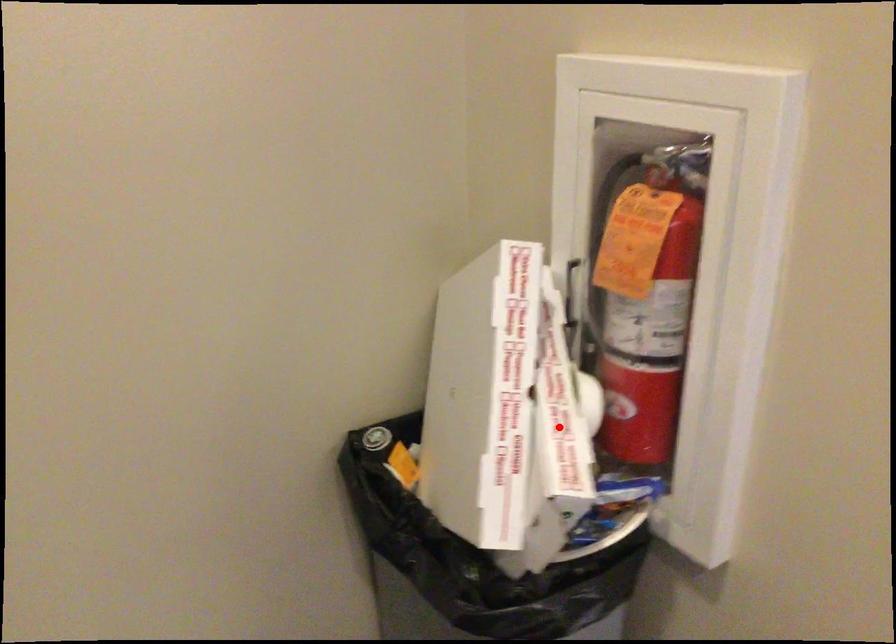
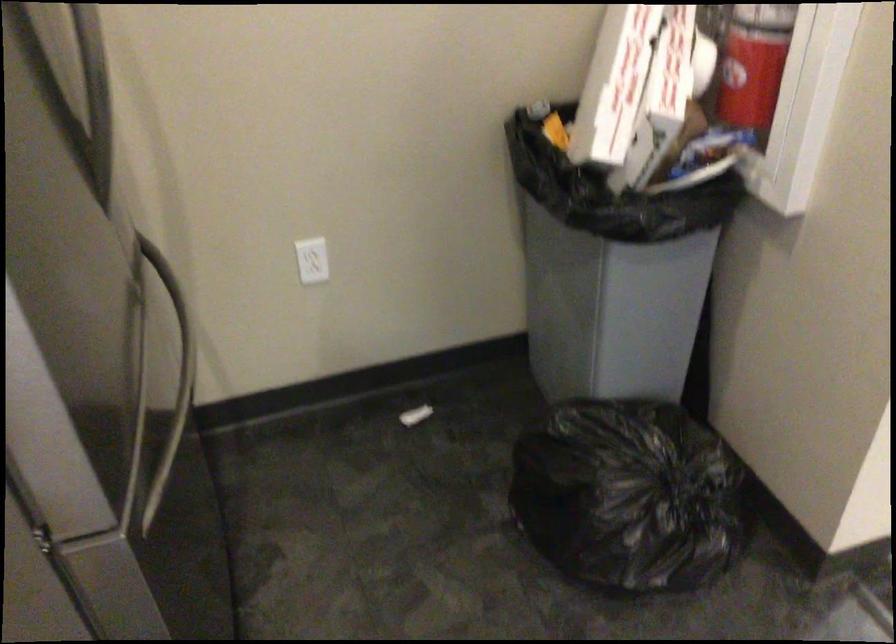
Locate, in the second image, the point that corresponds to the highlighted location in the first image.

(670, 64)